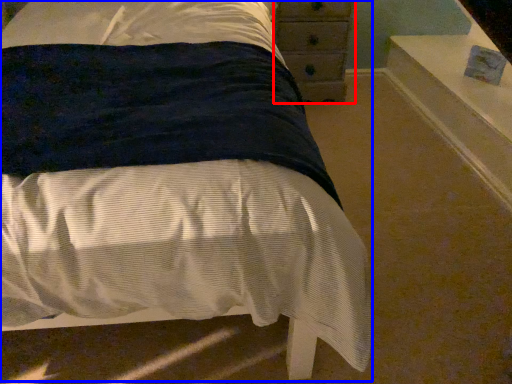
Question: Which of the following is the farthest to the observer, chest of drawers (highlighted by a red box) or bed (highlighted by a blue box)?

Choices:
 (A) chest of drawers
 (B) bed

Answer: (A)